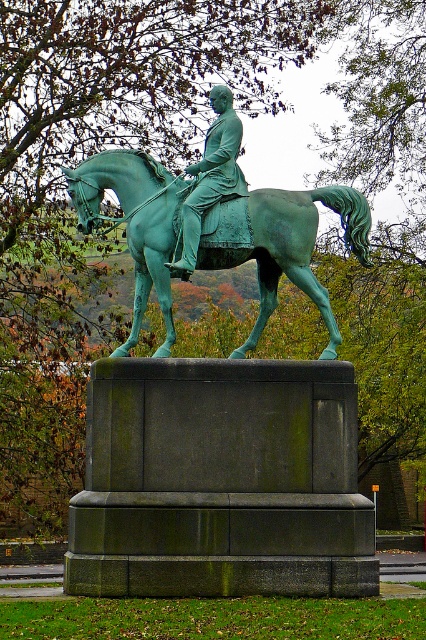
Question: Is green patina horse at center thinner than green patina statue at center?

Choices:
 (A) no
 (B) yes

Answer: (A)

Question: Which object is the farthest from the green patina horse at center?

Choices:
 (A) green patina statue at center
 (B) green patinated bronze statue at center

Answer: (A)

Question: Is green patinated bronze statue at center to the right of green patina statue at center from the viewer's perspective?

Choices:
 (A) yes
 (B) no

Answer: (A)

Question: Among these objects, which one is nearest to the camera?

Choices:
 (A) green patinated bronze statue at center
 (B) green patina statue at center
 (C) green patina horse at center

Answer: (A)

Question: Which point is closer to the camera?

Choices:
 (A) green patina statue at center
 (B) green patina horse at center

Answer: (A)

Question: Can you confirm if green patinated bronze statue at center is positioned to the right of green patina statue at center?

Choices:
 (A) no
 (B) yes

Answer: (B)